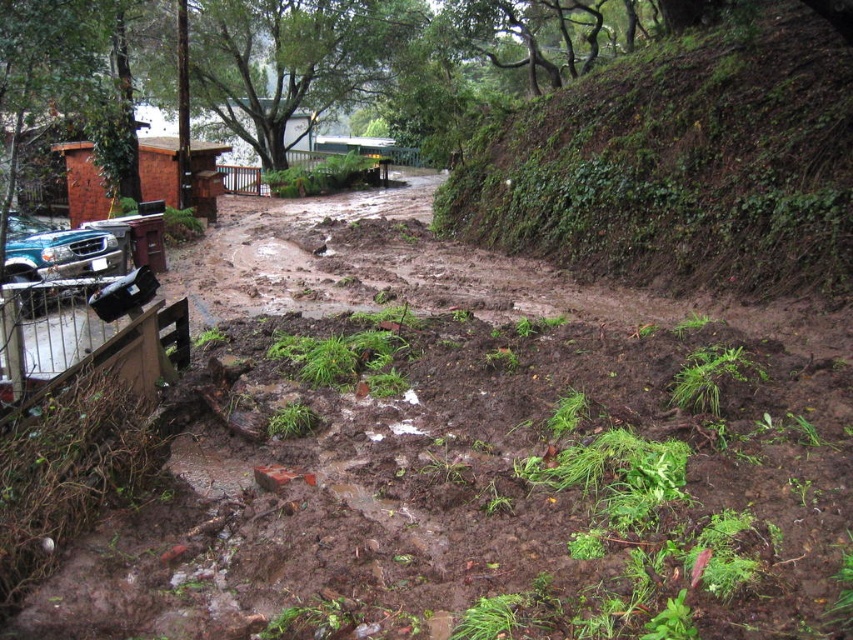
You are a geologist analyzing the erosion patterns in the image. You notice the green mossy hillside at upper right. Where exactly is this hillside located in the image?

The green mossy hillside at upper right is located at point (x=679, y=164) in the image.

You are a rescue worker assessing the area after a flood. You notice the green mossy hillside at upper right and the matte blue truck at left. Which object is positioned closer to your current location?

The green mossy hillside at upper right is closer to the viewer than the matte blue truck at left, so the hillside is positioned closer to your current location.